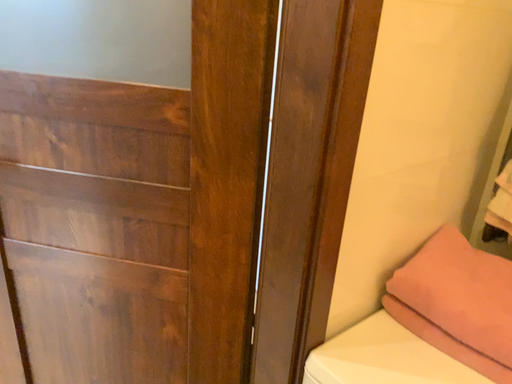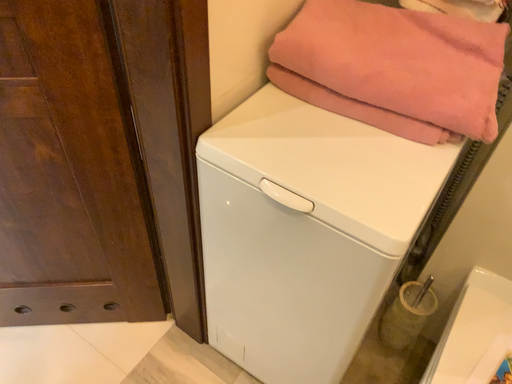
Question: Which way did the camera rotate in the video?

Choices:
 (A) rotated right
 (B) rotated left

Answer: (A)